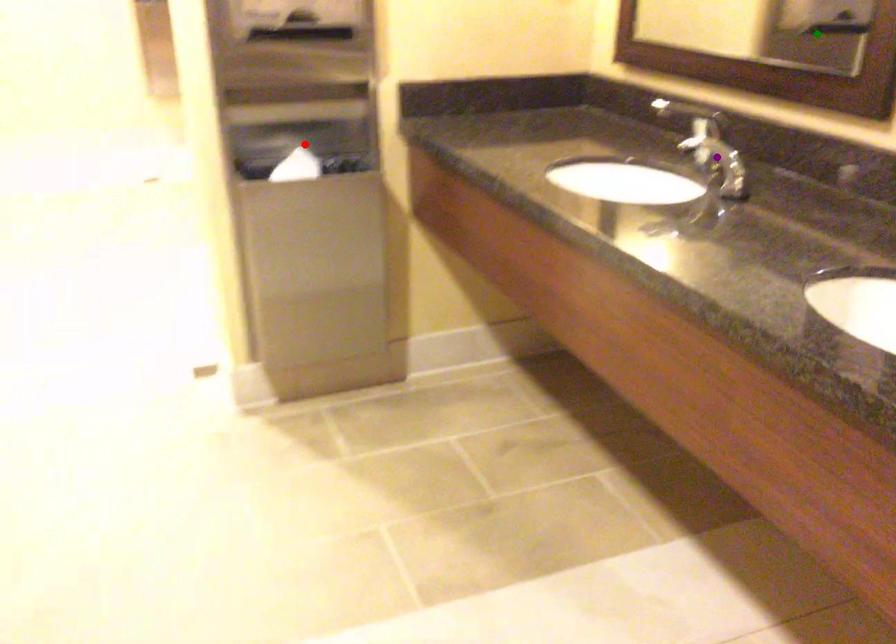
Order these from nearest to farthest:
green point, red point, purple point

purple point
red point
green point